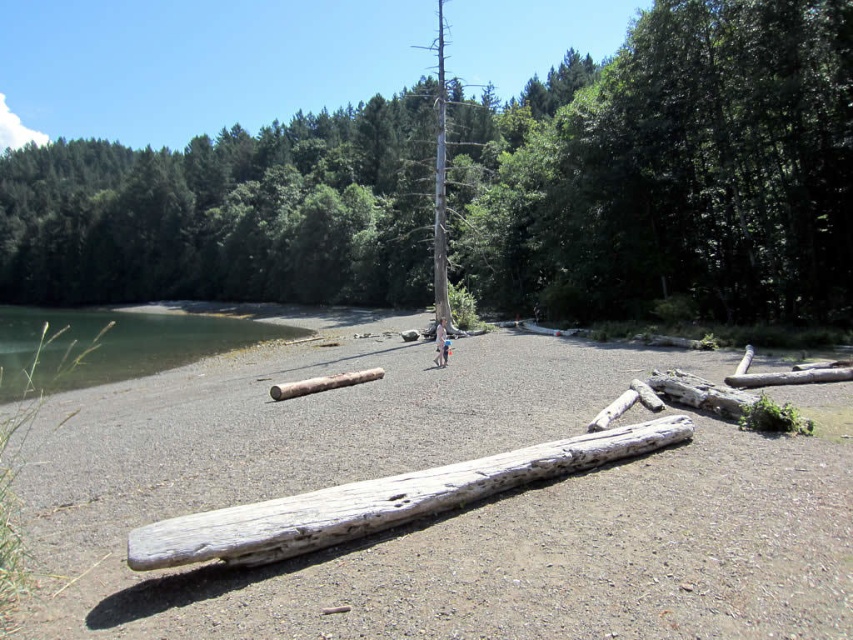
You are standing at the camera position and want to walk to both points in the image. Which point should you reach first, point (154,484) or point (444,340)?

You will reach point (154,484) first because it is closer to the camera than point (444,340).